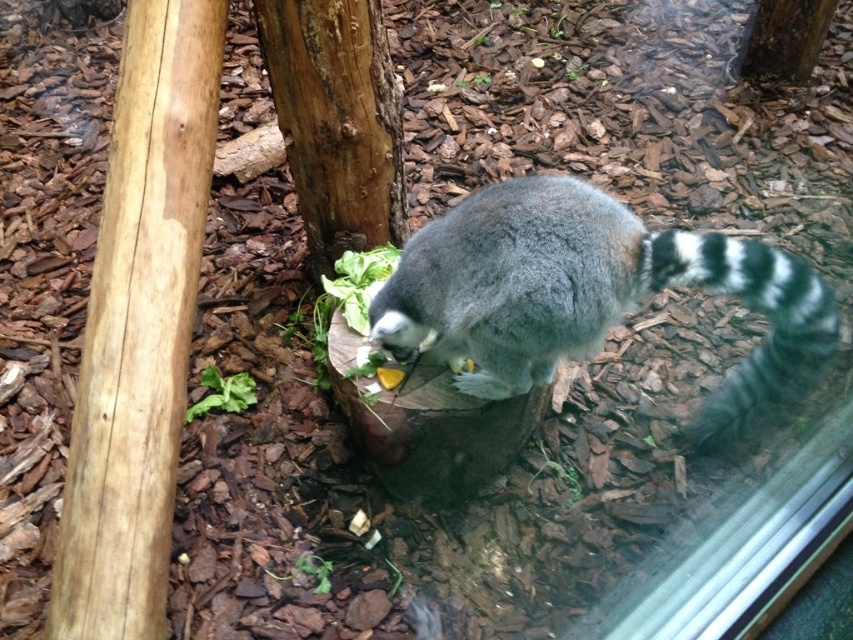
You are a zookeeper standing near the lemur and want to place a new feeding tray. You need to choose between placing it on the brown rough bark at center or the brown rough bark at upper center. Which location is closer to the lemur?

The brown rough bark at center is closer to the lemur because it is closer to the viewer than the brown rough bark at upper center.

You are a zookeeper who needs to place a new feeding tray for the lemur. The tray is 2 meters long. You see two brown rough bark areas in the enclosure. Can you fit the feeding tray between the brown rough bark at center and the brown rough bark at upper center?

The distance between the brown rough bark at center and the brown rough bark at upper center is 1.91 meters. Since the feeding tray is 2 meters long, it cannot fit between them as the space is slightly shorter than the tray.